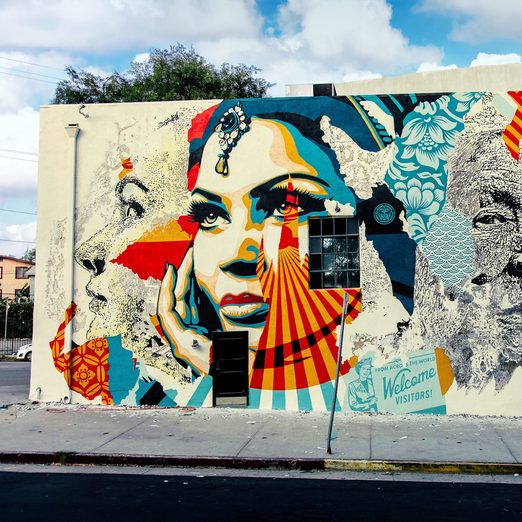
The image size is (522, 522). Find the location of `window`. window is located at coordinates (328, 247).